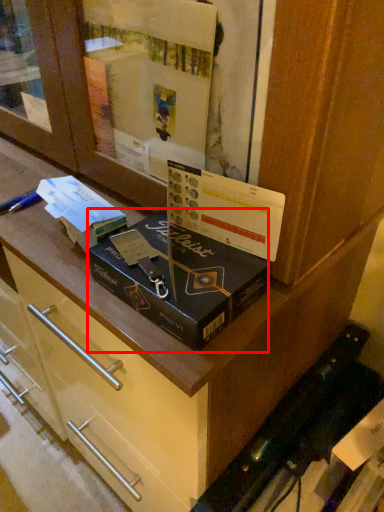
Question: From the image's perspective, what is the correct spatial positioning of box (annotated by the red box) in reference to book?

Choices:
 (A) below
 (B) above

Answer: (A)